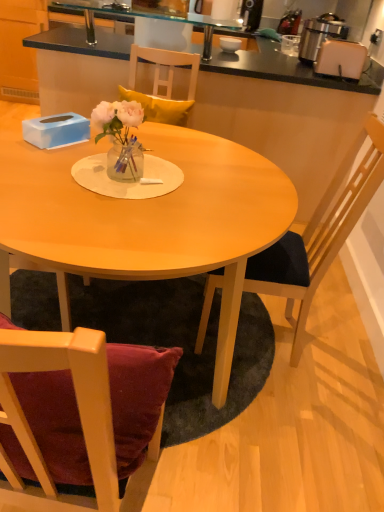
Question: Can you confirm if white glossy bowl at upper center is bigger than black laminate cabinet at upper left?

Choices:
 (A) yes
 (B) no

Answer: (B)

Question: Considering the relative sizes of white glossy bowl at upper center and black laminate cabinet at upper left in the image provided, is white glossy bowl at upper center thinner than black laminate cabinet at upper left?

Choices:
 (A) no
 (B) yes

Answer: (B)

Question: From the image's perspective, is white glossy bowl at upper center located beneath black laminate cabinet at upper left?

Choices:
 (A) no
 (B) yes

Answer: (B)

Question: Does white glossy bowl at upper center lie in front of black laminate cabinet at upper left?

Choices:
 (A) yes
 (B) no

Answer: (A)

Question: Is white glossy bowl at upper center turned away from black laminate cabinet at upper left?

Choices:
 (A) no
 (B) yes

Answer: (A)

Question: Considering the positions of metallic silver toaster at upper right and matte wood table at center in the image, is metallic silver toaster at upper right taller or shorter than matte wood table at center?

Choices:
 (A) tall
 (B) short

Answer: (B)

Question: Is metallic silver toaster at upper right inside or outside of matte wood table at center?

Choices:
 (A) outside
 (B) inside

Answer: (A)

Question: Is point (306, 33) positioned closer to the camera than point (1, 294)?

Choices:
 (A) closer
 (B) farther

Answer: (B)

Question: From a real-world perspective, is metallic silver toaster at upper right positioned above or below matte wood table at center?

Choices:
 (A) above
 (B) below

Answer: (A)

Question: Considering the positions of wooden chair at right and transparent glass sink at upper center in the image, is wooden chair at right taller or shorter than transparent glass sink at upper center?

Choices:
 (A) short
 (B) tall

Answer: (B)

Question: From the image's perspective, is wooden chair at right positioned above or below transparent glass sink at upper center?

Choices:
 (A) below
 (B) above

Answer: (A)

Question: From a real-world perspective, relative to transparent glass sink at upper center, is wooden chair at right vertically above or below?

Choices:
 (A) below
 (B) above

Answer: (A)

Question: Looking at the image, does wooden chair at right seem bigger or smaller compared to transparent glass sink at upper center?

Choices:
 (A) big
 (B) small

Answer: (A)

Question: Would you say white plastic toaster at upper right is inside or outside metallic silver toaster at upper right?

Choices:
 (A) outside
 (B) inside

Answer: (A)

Question: Does point (347, 74) appear closer or farther from the camera than point (306, 41)?

Choices:
 (A) farther
 (B) closer

Answer: (B)